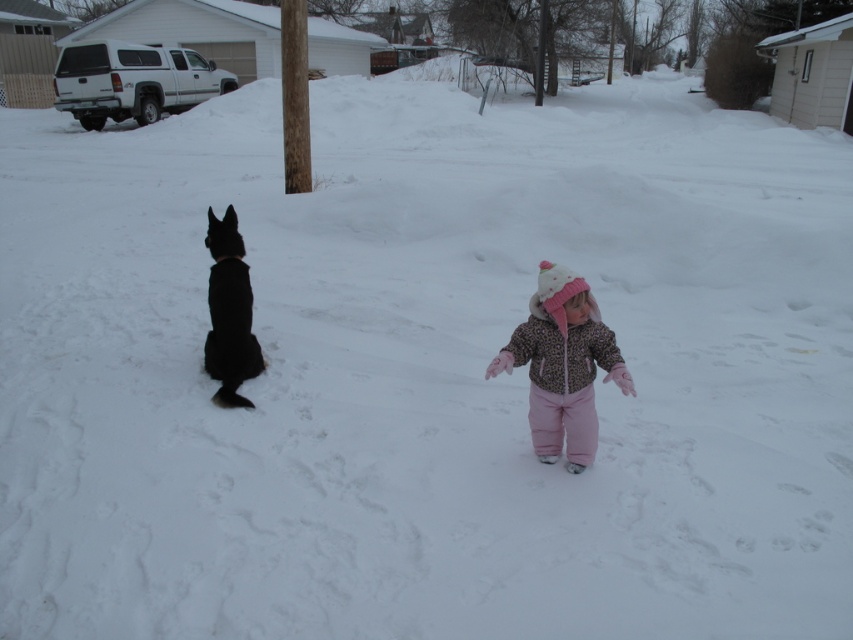
Question: Which point is closer to the camera?

Choices:
 (A) (224, 340)
 (B) (555, 456)

Answer: (B)

Question: Can you confirm if leopard print jacket at center is positioned to the left of black fur dog at left?

Choices:
 (A) yes
 (B) no

Answer: (B)

Question: Can you confirm if leopard print jacket at center is positioned to the right of black fur dog at left?

Choices:
 (A) yes
 (B) no

Answer: (A)

Question: From the image, what is the correct spatial relationship of leopard print jacket at center in relation to black fur dog at left?

Choices:
 (A) right
 (B) left

Answer: (A)